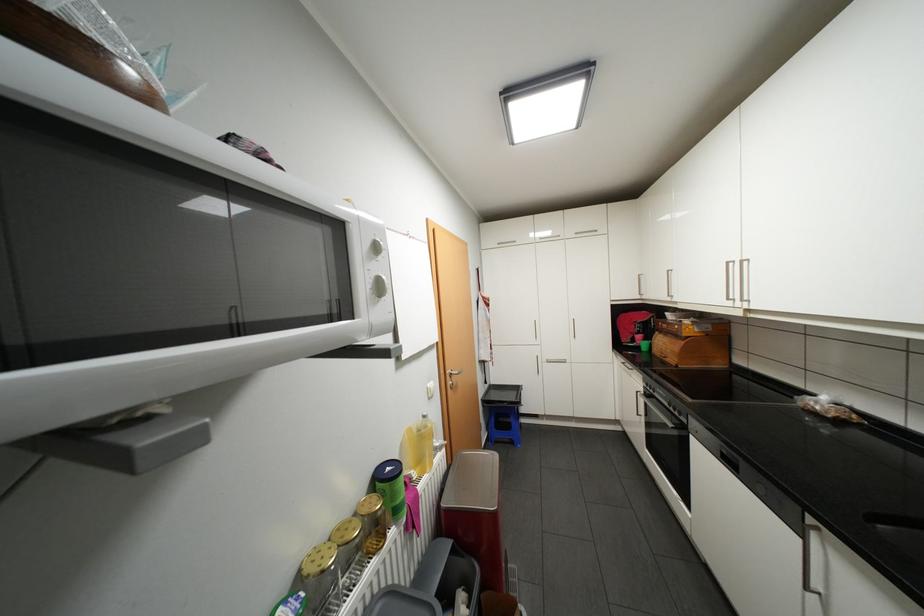
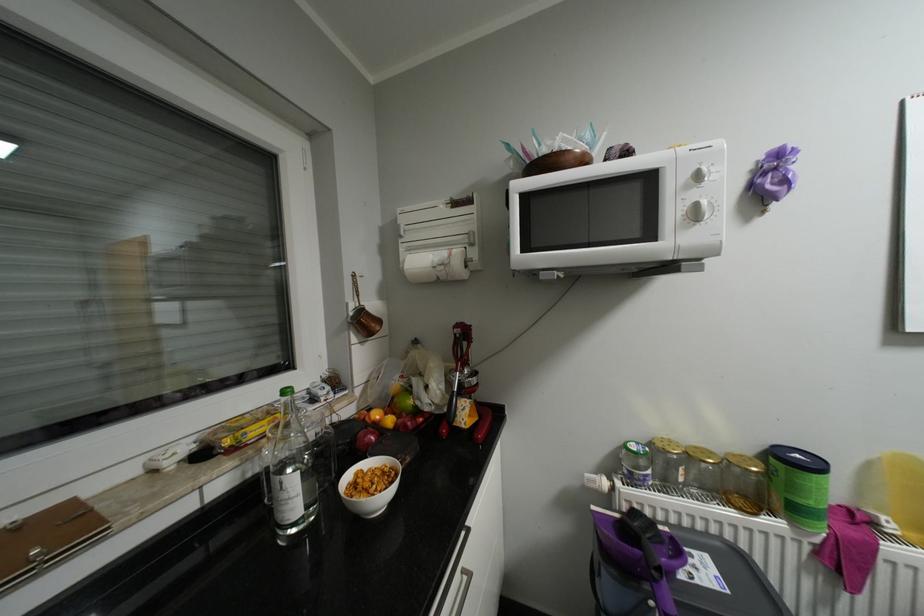
Question: The images are taken continuously from a first-person perspective. In which direction is your viewpoint rotating?

Choices:
 (A) Left
 (B) Right
 (C) Up
 (D) Down

Answer: (A)